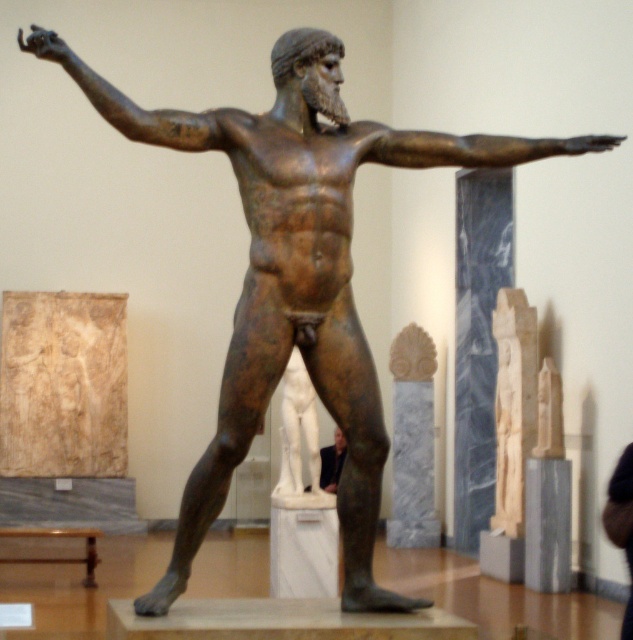
Can you confirm if bronze muscular arm at center is thinner than bronze arm at upper left?

No.

From the picture: Can you confirm if bronze muscular arm at center is wider than bronze arm at upper left?

Indeed, bronze muscular arm at center has a greater width compared to bronze arm at upper left.

Does point (418, 141) lie in front of point (130, 120)?

No, it is behind (130, 120).

Identify the location of bronze muscular arm at center. The width and height of the screenshot is (633, 640). (467, 147).

Between bronze arm at upper left and dark suit at center, which one has less height?

Standing shorter between the two is bronze arm at upper left.

Is bronze arm at upper left positioned behind dark suit at center?

No, bronze arm at upper left is in front of dark suit at center.

The width and height of the screenshot is (633, 640). What do you see at coordinates (125, 100) in the screenshot?
I see `bronze arm at upper left` at bounding box center [125, 100].

This screenshot has height=640, width=633. I want to click on bronze arm at upper left, so click(x=125, y=100).

Measure the distance between bronze muscular arm at center and dark suit at center.

bronze muscular arm at center is 11.84 meters from dark suit at center.

What do you see at coordinates (467, 147) in the screenshot? I see `bronze muscular arm at center` at bounding box center [467, 147].

Locate an element on the screen. bronze muscular arm at center is located at coordinates (467, 147).